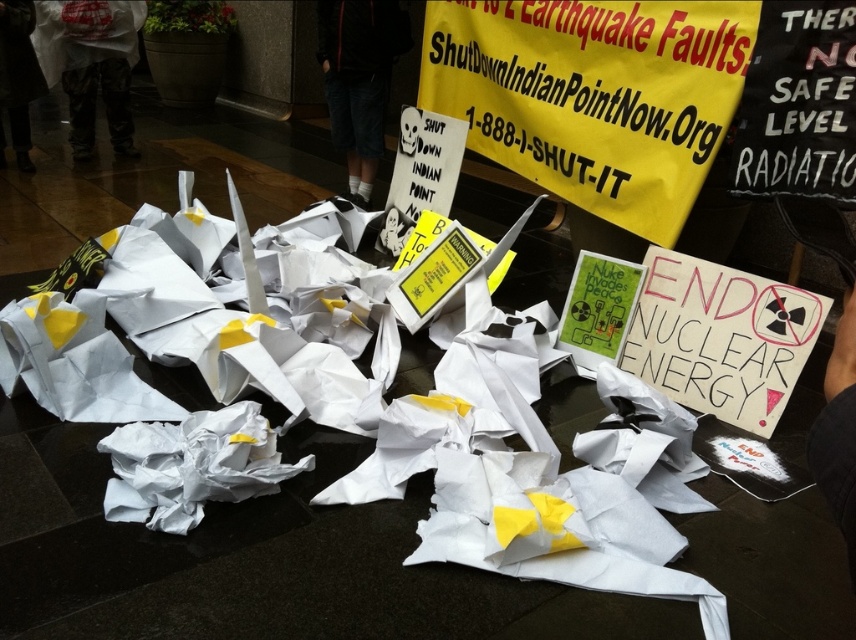
Can you confirm if white crumpled paper at center is wider than camouflage pants at left?

Indeed, white crumpled paper at center has a greater width compared to camouflage pants at left.

Is white crumpled paper at center smaller than camouflage pants at left?

No, white crumpled paper at center is not smaller than camouflage pants at left.

You are a GUI agent. You are given a task and a screenshot of the screen. Output one action in this format:
    pyautogui.click(x=<x>, y=<y>)
    Task: Click on the white crumpled paper at center
    This screenshot has width=856, height=640.
    Given the screenshot: What is the action you would take?
    pyautogui.click(x=348, y=417)

Is point (355, 49) closer to viewer compared to point (125, 125)?

Yes, it is in front of point (125, 125).

Describe the element at coordinates (360, 77) in the screenshot. The image size is (856, 640). I see `white cotton shorts at center` at that location.

The image size is (856, 640). What are the coordinates of `white cotton shorts at center` in the screenshot? It's located at (360, 77).

Is white crumpled paper at center to the left of white cotton shorts at center from the viewer's perspective?

Incorrect, white crumpled paper at center is not on the left side of white cotton shorts at center.

Who is shorter, white crumpled paper at center or white cotton shorts at center?

white cotton shorts at center

Describe the element at coordinates (348, 417) in the screenshot. I see `white crumpled paper at center` at that location.

I want to click on white crumpled paper at center, so click(348, 417).